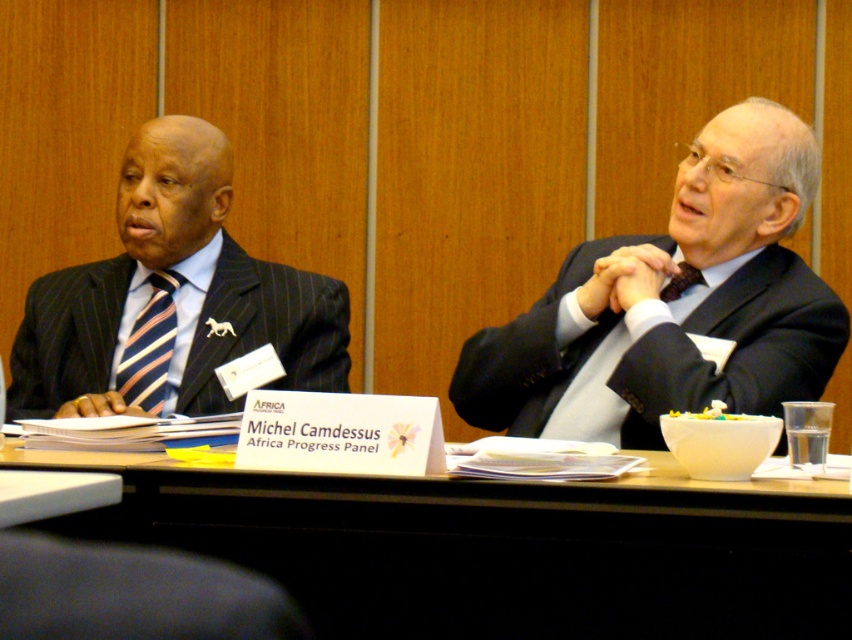
You are a person who is 1.7 meters tall and standing in front of the wooden table at center. Can you comfortably reach the items placed on the table without leaning over?

The wooden table at center is 1.38 meters away from the viewer. Since the average table height is around 0.76 meters, and the person is 1.7 meters tall, they can comfortably reach the items on the table without leaning over.

Looking at this image, you are an event organizer who needs to ensure that the nameplates are placed correctly. The nameplate for the person in the matte black suit at left must be positioned so it doesn not cover the striped fabric tie at left. Given their sizes, where should the nameplate be placed?

The matte black suit at left is larger in size than the striped fabric tie at left, so the nameplate should be placed on the larger matte black suit at left to avoid covering the smaller striped fabric tie at left.